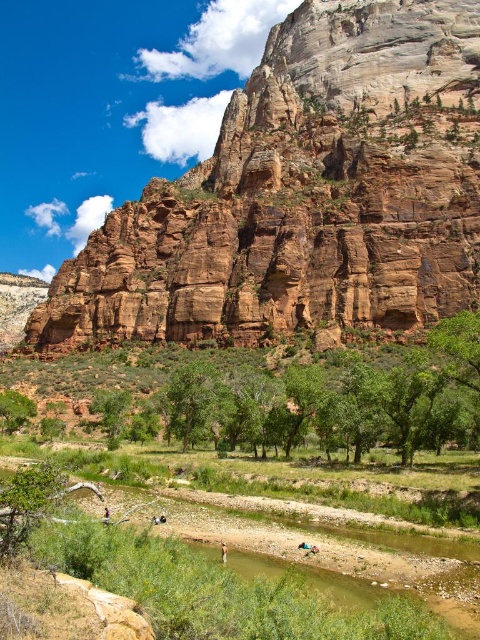
You are standing at the edge of the green grassy river at center and want to cross to the other side. The light brown leather jacket at lower center is nearby. Can you use the jacket to help cross the river?

The green grassy river at center is wider than the light brown leather jacket at lower center, so the jacket is not long enough to bridge the river. You will need a longer object to cross safely.

You are standing at the base of the towering red rock cliffs and want to cross the green grassy river at center. Which direction should you walk to reach the river first?

The green grassy river at center is located at point 0.930 on the x axis and 0.369 on the y axis. Since you are at the base of the cliffs, you should walk towards the center of the image where the river is located.